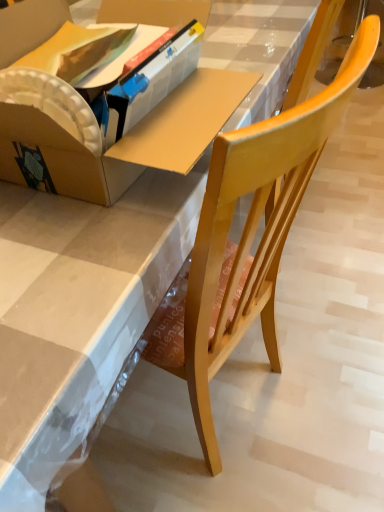
This screenshot has width=384, height=512. What do you see at coordinates (93, 113) in the screenshot?
I see `matte cardboard box at center` at bounding box center [93, 113].

Image resolution: width=384 pixels, height=512 pixels. I want to click on matte cardboard box at center, so click(93, 113).

Locate an element on the screen. wooden chair at center is located at coordinates (248, 237).

In order to face wooden chair at center, should I rotate leftwards or rightwards?

Turn right approximately 3.299 degrees to face it.

What do you see at coordinates (248, 237) in the screenshot?
I see `wooden chair at center` at bounding box center [248, 237].

Where is `matte cardboard box at center`? matte cardboard box at center is located at coordinates (93, 113).

Between wooden chair at center and matte cardboard box at center, which one appears on the right side from the viewer's perspective?

Positioned to the right is wooden chair at center.

Which is behind, wooden chair at center or matte cardboard box at center?

matte cardboard box at center is behind.

Which is in front, point (176, 360) or point (77, 49)?

Positioned in front is point (77, 49).

From the image's perspective, is wooden chair at center above matte cardboard box at center?

No, from the image's perspective, wooden chair at center is not over matte cardboard box at center.

From a real-world perspective, is wooden chair at center positioned above or below matte cardboard box at center?

From a real-world perspective, wooden chair at center is physically below matte cardboard box at center.

Considering the sizes of objects wooden chair at center and matte cardboard box at center in the image provided, who is thinner, wooden chair at center or matte cardboard box at center?

wooden chair at center is thinner.

Does wooden chair at center have a lesser height compared to matte cardboard box at center?

No.

Looking at this image, does wooden chair at center have a larger size compared to matte cardboard box at center?

Yes.

Which is correct: wooden chair at center is inside matte cardboard box at center, or outside of it?

wooden chair at center is not enclosed by matte cardboard box at center.

Is wooden chair at center in contact with matte cardboard box at center?

They are not placed beside each other.

Is wooden chair at center facing towards matte cardboard box at center?

Yes, wooden chair at center is oriented towards matte cardboard box at center.

What's the angular difference between wooden chair at center and matte cardboard box at center's facing directions?

wooden chair at center and matte cardboard box at center are facing 75.4 degrees away from each other.

Measure the distance between wooden chair at center and matte cardboard box at center.

They are 14.71 inches apart.

You are a GUI agent. You are given a task and a screenshot of the screen. Output one action in this format:
    pyautogui.click(x=<x>, y=<y>)
    Task: Click on the box behind the wooden chair at center
    This screenshot has height=512, width=384.
    Given the screenshot: What is the action you would take?
    pyautogui.click(x=93, y=113)

Which is more to the left, matte cardboard box at center or wooden chair at center?

From the viewer's perspective, matte cardboard box at center appears more on the left side.

Which object is further away from the camera, matte cardboard box at center or wooden chair at center?

Positioned behind is matte cardboard box at center.

Is point (4, 45) more distant than point (235, 334)?

No, (4, 45) is in front of (235, 334).

From the image's perspective, is matte cardboard box at center under wooden chair at center?

Incorrect, from the image's perspective, matte cardboard box at center is higher than wooden chair at center.

From a real-world perspective, relative to wooden chair at center, is matte cardboard box at center vertically above or below?

In terms of real-world spatial position, matte cardboard box at center is above wooden chair at center.

Between matte cardboard box at center and wooden chair at center, which one has larger width?

With larger width is matte cardboard box at center.

Can you confirm if matte cardboard box at center is shorter than wooden chair at center?

Yes, matte cardboard box at center is shorter than wooden chair at center.

Considering the sizes of objects matte cardboard box at center and wooden chair at center in the image provided, who is smaller, matte cardboard box at center or wooden chair at center?

matte cardboard box at center.

Would you say matte cardboard box at center is outside wooden chair at center?

No, most part of matte cardboard box at center lies within wooden chair at center.

Would you say matte cardboard box at center is a long distance from wooden chair at center?

No, matte cardboard box at center is not far from wooden chair at center.

Is matte cardboard box at center oriented away from wooden chair at center?

Yes, matte cardboard box at center is positioned with its back facing wooden chair at center.

In the scene shown: Can you tell me how much matte cardboard box at center and wooden chair at center differ in facing direction?

There is a 75.4-degree angle between the facing directions of matte cardboard box at center and wooden chair at center.

How far apart are matte cardboard box at center and wooden chair at center?

They are 14.71 inches apart.

The height and width of the screenshot is (512, 384). Find the location of `chair below the matte cardboard box at center (from a real-world perspective)`. chair below the matte cardboard box at center (from a real-world perspective) is located at coordinates (248, 237).

In order to click on box on the left of wooden chair at center in this screenshot , I will do `click(93, 113)`.

At what (x,y) coordinates should I click in order to perform the action: click on box that is behind the wooden chair at center. Please return your answer as a coordinate pair (x, y). This screenshot has height=512, width=384. Looking at the image, I should click on (93, 113).